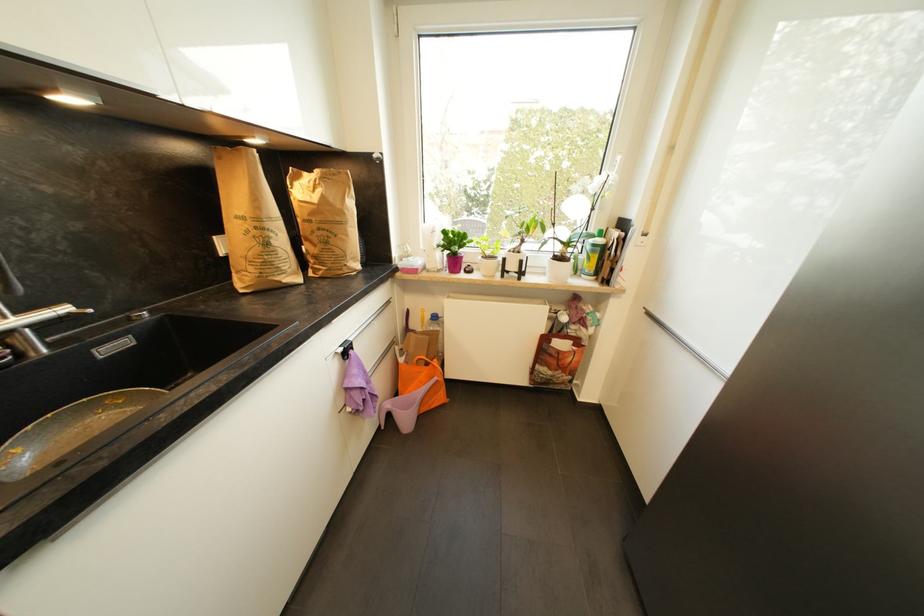
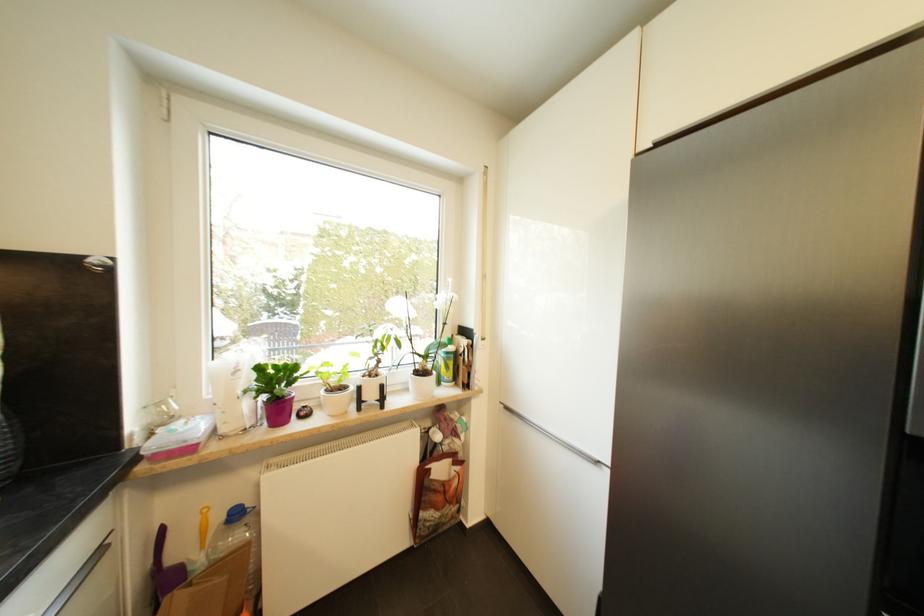
In the second image, find the point that corresponds to point 459,265 in the first image.

(285, 411)